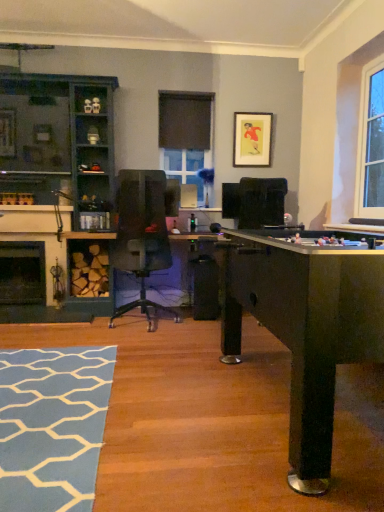
Question: From a real-world perspective, is blue textured rug at lower left positioned over black stone fireplace at lower left, which is the first fireplace in back-to-front order, based on gravity?

Choices:
 (A) yes
 (B) no

Answer: (B)

Question: From the image's perspective, is blue textured rug at lower left over black stone fireplace at lower left, which appears as the second fireplace when viewed from the front?

Choices:
 (A) yes
 (B) no

Answer: (B)

Question: Is blue textured rug at lower left not inside black stone fireplace at lower left, which appears as the second fireplace when viewed from the front?

Choices:
 (A) no
 (B) yes

Answer: (B)

Question: Is blue textured rug at lower left directly adjacent to black stone fireplace at lower left, which is the first fireplace in back-to-front order?

Choices:
 (A) no
 (B) yes

Answer: (A)

Question: Does blue textured rug at lower left come behind black stone fireplace at lower left, which is the first fireplace in back-to-front order?

Choices:
 (A) no
 (B) yes

Answer: (A)

Question: Is blue textured rug at lower left facing towards black stone fireplace at lower left, which appears as the second fireplace when viewed from the front?

Choices:
 (A) no
 (B) yes

Answer: (A)

Question: Is blue textured rug at lower left turned away from matte gold picture frame at upper center?

Choices:
 (A) no
 (B) yes

Answer: (A)

Question: Is blue textured rug at lower left not near matte gold picture frame at upper center?

Choices:
 (A) yes
 (B) no

Answer: (A)

Question: From a real-world perspective, is blue textured rug at lower left below matte gold picture frame at upper center?

Choices:
 (A) no
 (B) yes

Answer: (B)

Question: Is blue textured rug at lower left in front of matte gold picture frame at upper center?

Choices:
 (A) no
 (B) yes

Answer: (B)

Question: Is blue textured rug at lower left wider than matte gold picture frame at upper center?

Choices:
 (A) no
 (B) yes

Answer: (B)

Question: From the image's perspective, is blue textured rug at lower left above matte gold picture frame at upper center?

Choices:
 (A) no
 (B) yes

Answer: (A)

Question: Does teal wood cabinet at left have a greater height compared to transparent glass window screen at center?

Choices:
 (A) no
 (B) yes

Answer: (B)